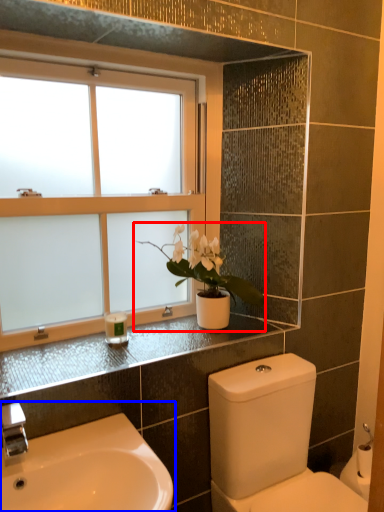
Question: Which of the following is the closest to the observer, houseplant (highlighted by a red box) or sink (highlighted by a blue box)?

Choices:
 (A) houseplant
 (B) sink

Answer: (B)